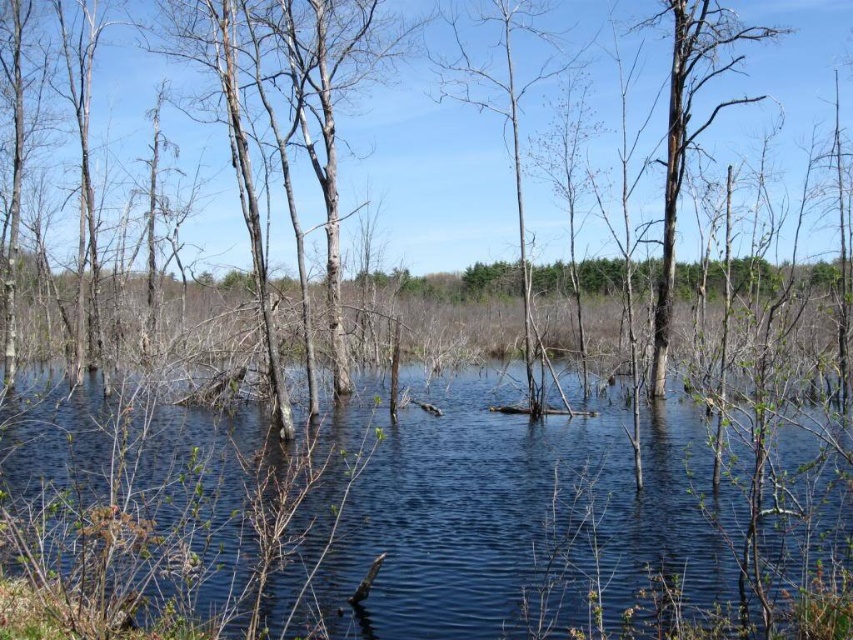
Is clear water at center thinner than charred wood tree at right?

Incorrect, clear water at center's width is not less than charred wood tree at right's.

Does clear water at center come in front of charred wood tree at right?

Yes, it is.

Image resolution: width=853 pixels, height=640 pixels. What do you see at coordinates (519, 513) in the screenshot? I see `clear water at center` at bounding box center [519, 513].

Where is `clear water at center`? Image resolution: width=853 pixels, height=640 pixels. clear water at center is located at coordinates (519, 513).

Which of these two, clear water at center or smooth bark tree at center, stands taller?

With more height is smooth bark tree at center.

Is clear water at center to the right of smooth bark tree at center from the viewer's perspective?

In fact, clear water at center is to the left of smooth bark tree at center.

Does point (844, 552) come in front of point (527, 344)?

Yes.

Identify the location of clear water at center. (519, 513).

What do you see at coordinates (689, 129) in the screenshot? Image resolution: width=853 pixels, height=640 pixels. I see `charred wood tree at right` at bounding box center [689, 129].

Does charred wood tree at right lie in front of smooth bark tree at center?

That is False.

Locate an element on the screen. charred wood tree at right is located at coordinates (689, 129).